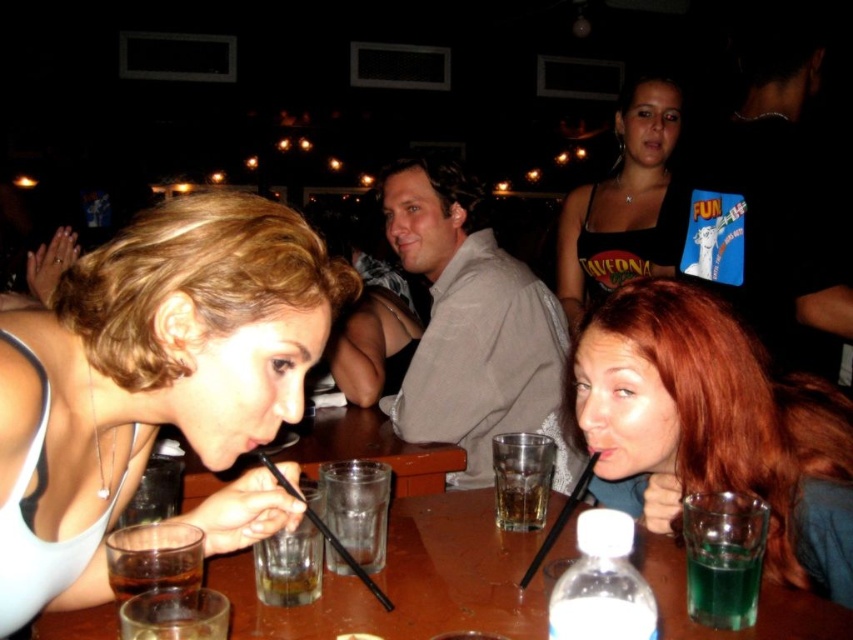
Does black cotton shirt at upper right appear under black tank top at upper center?

Yes.

Is black cotton shirt at upper right wider than black tank top at upper center?

No, black cotton shirt at upper right is not wider than black tank top at upper center.

Describe the element at coordinates (769, 205) in the screenshot. The width and height of the screenshot is (853, 640). I see `black cotton shirt at upper right` at that location.

Image resolution: width=853 pixels, height=640 pixels. Identify the location of black cotton shirt at upper right. (769, 205).

Is light beige shirt at center thinner than translucent glass at table center?

Incorrect, light beige shirt at center's width is not less than translucent glass at table center's.

Does point (474, 348) come farther from viewer compared to point (509, 490)?

Yes, it is.

Image resolution: width=853 pixels, height=640 pixels. Describe the element at coordinates (473, 328) in the screenshot. I see `light beige shirt at center` at that location.

Find the location of a particular element. The width and height of the screenshot is (853, 640). light beige shirt at center is located at coordinates (473, 328).

Who is taller, matte white tank top at center or green translucent glass at lower right?

matte white tank top at center is taller.

Is matte white tank top at center bigger than green translucent glass at lower right?

Yes.

Which is in front, point (210, 440) or point (714, 536)?

Positioned in front is point (210, 440).

At what (x,y) coordinates should I click in order to perform the action: click on matte white tank top at center. Please return your answer as a coordinate pair (x, y). This screenshot has height=640, width=853. Looking at the image, I should click on (149, 376).